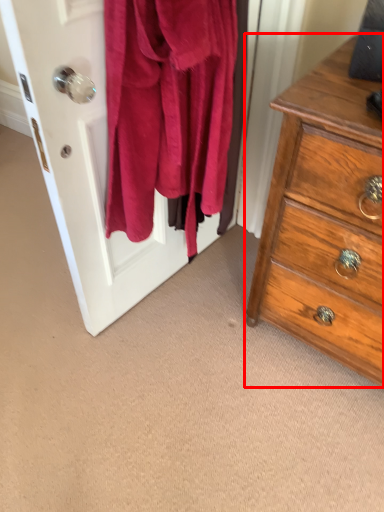
Question: Considering the relative positions of chest of drawers (annotated by the red box) and screen door in the image provided, where is chest of drawers (annotated by the red box) located with respect to the staircase?

Choices:
 (A) left
 (B) right

Answer: (B)